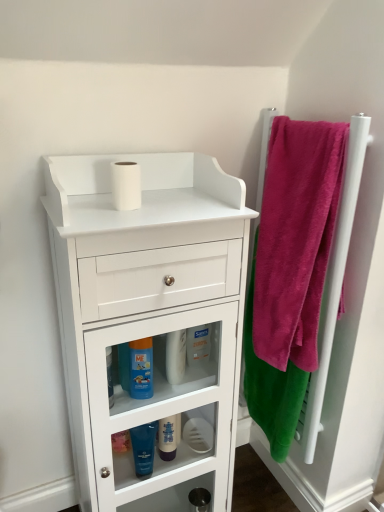
Question: Does velvet pink towel at right come behind white plastic bottle at center?

Choices:
 (A) yes
 (B) no

Answer: (B)

Question: From the image's perspective, is velvet pink towel at right below white plastic bottle at center?

Choices:
 (A) no
 (B) yes

Answer: (B)

Question: Does velvet pink towel at right have a greater width compared to white plastic bottle at center?

Choices:
 (A) yes
 (B) no

Answer: (A)

Question: From a real-world perspective, is velvet pink towel at right physically above white plastic bottle at center?

Choices:
 (A) yes
 (B) no

Answer: (B)

Question: Is velvet pink towel at right at the left side of white plastic bottle at center?

Choices:
 (A) no
 (B) yes

Answer: (A)

Question: From the image's perspective, is pink soft towel at right located above or below white plastic bottle at center?

Choices:
 (A) below
 (B) above

Answer: (B)

Question: Do you think pink soft towel at right is within white plastic bottle at center, or outside of it?

Choices:
 (A) outside
 (B) inside

Answer: (A)

Question: From a real-world perspective, relative to white plastic bottle at center, is pink soft towel at right vertically above or below?

Choices:
 (A) above
 (B) below

Answer: (A)

Question: In terms of height, does pink soft towel at right look taller or shorter compared to white plastic bottle at center?

Choices:
 (A) tall
 (B) short

Answer: (A)

Question: Is white matte toilet paper at upper center, placed as the 1th toilet paper when sorted from top to bottom, wider or thinner than blue glossy mouthwash at lower center, which is the 3th mouthwash in bottom-to-top order?

Choices:
 (A) thin
 (B) wide

Answer: (B)

Question: From a real-world perspective, relative to blue glossy mouthwash at lower center, which is the 3th mouthwash in bottom-to-top order, is white matte toilet paper at upper center, placed as the 1th toilet paper when sorted from top to bottom, vertically above or below?

Choices:
 (A) below
 (B) above

Answer: (B)

Question: From the image's perspective, is white matte toilet paper at upper center, acting as the 2th toilet paper starting from the right, located above or below blue glossy mouthwash at lower center, which is the 3th mouthwash in bottom-to-top order?

Choices:
 (A) below
 (B) above

Answer: (B)

Question: Choose the correct answer: Is white matte toilet paper at upper center, the second toilet paper in the bottom-to-top sequence, inside blue glossy mouthwash at lower center, the first mouthwash in the top-to-bottom sequence, or outside it?

Choices:
 (A) inside
 (B) outside

Answer: (B)

Question: Is blue glossy mouthwash at lower center, the first mouthwash in the top-to-bottom sequence, bigger or smaller than velvet pink towel at right?

Choices:
 (A) small
 (B) big

Answer: (A)

Question: Is blue glossy mouthwash at lower center, which is the 3th mouthwash in bottom-to-top order, situated inside velvet pink towel at right or outside?

Choices:
 (A) outside
 (B) inside

Answer: (A)